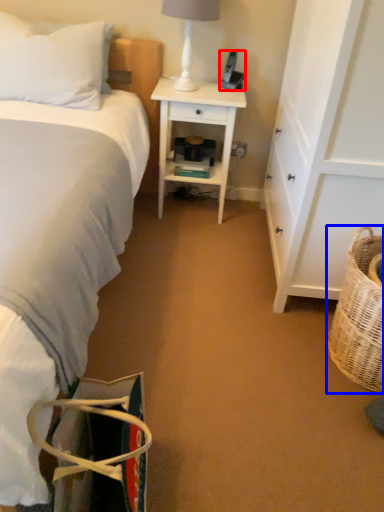
Question: Which object is further to the camera taking this photo, corded phone (highlighted by a red box) or picnic basket (highlighted by a blue box)?

Choices:
 (A) corded phone
 (B) picnic basket

Answer: (A)